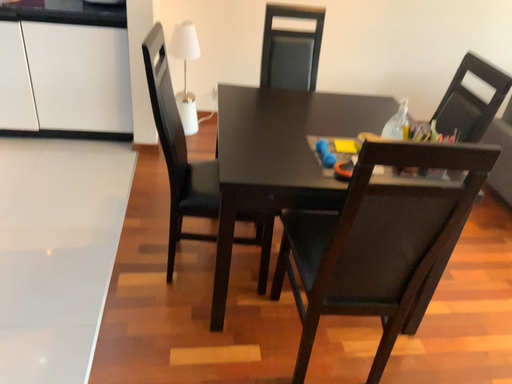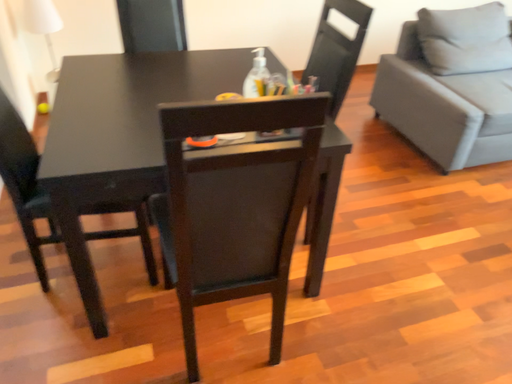
Question: How did the camera likely rotate when shooting the video?

Choices:
 (A) rotated left
 (B) rotated right

Answer: (B)